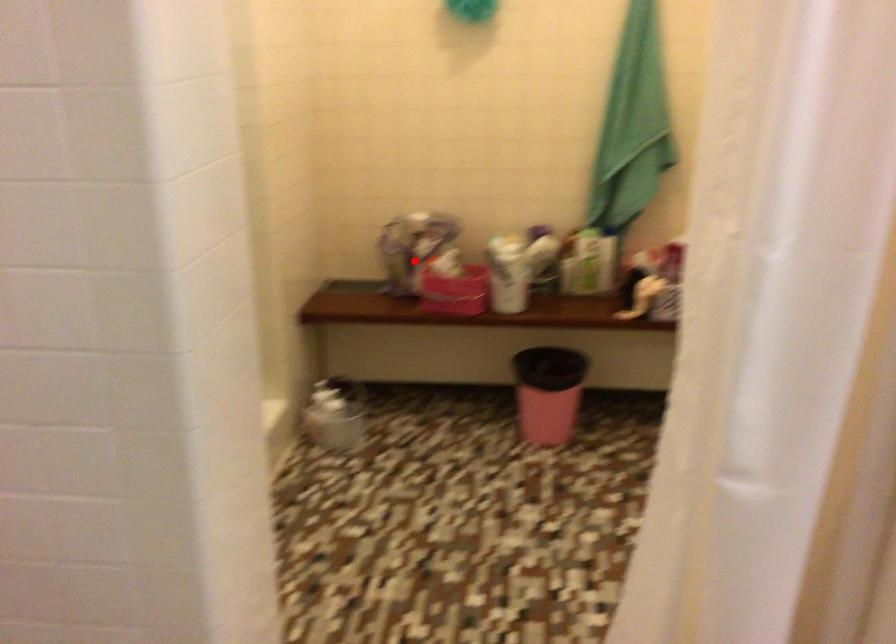
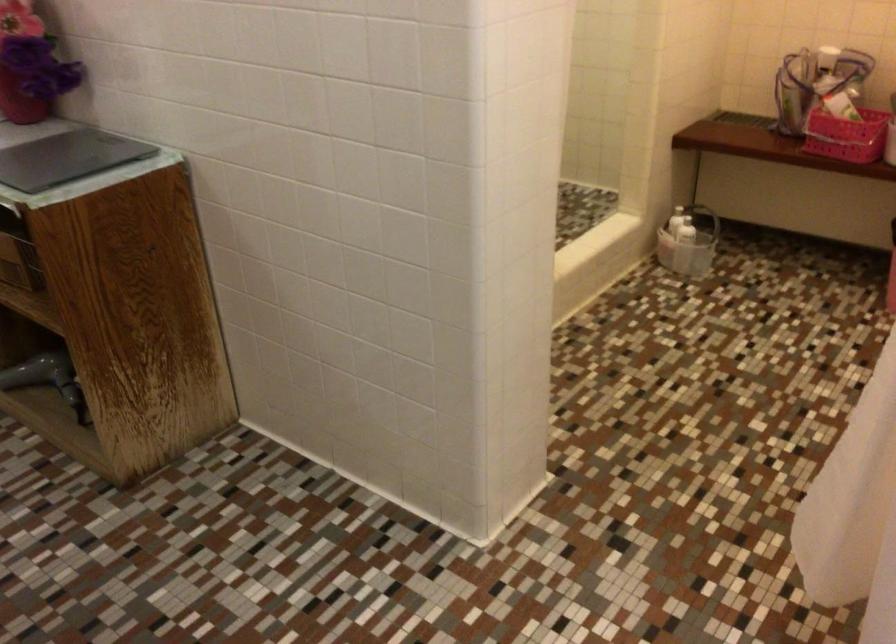
Where in the second image is the point corresponding to the highlighted location from the first image?

(815, 82)